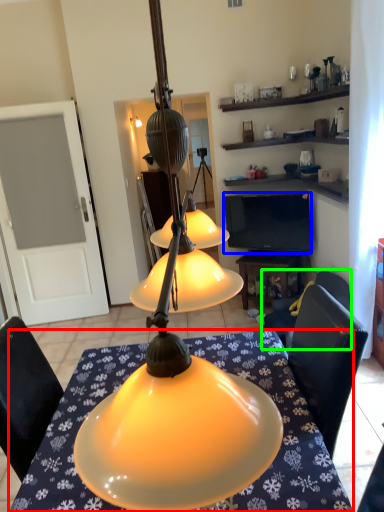
Question: Considering the real-world distances, which object is closest to desk (highlighted by a red box)? television (highlighted by a blue box) or chair (highlighted by a green box).

Choices:
 (A) television
 (B) chair

Answer: (B)